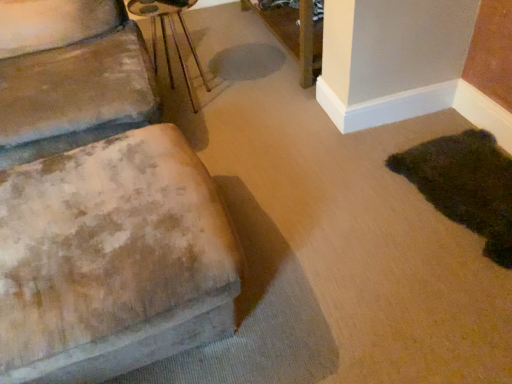
Question: In the image, is metallic silver side table at upper center positioned in front of or behind dark green plush rug at lower right?

Choices:
 (A) front
 (B) behind

Answer: (B)

Question: From the image's perspective, is metallic silver side table at upper center above or below dark green plush rug at lower right?

Choices:
 (A) below
 (B) above

Answer: (B)

Question: Which object is the farthest from the dark green plush rug at lower right?

Choices:
 (A) worn fabric ottoman at left
 (B) wooden table at upper center
 (C) metallic silver side table at upper center

Answer: (C)

Question: Which of these objects is positioned closest to the metallic silver side table at upper center?

Choices:
 (A) worn fabric ottoman at left
 (B) dark green plush rug at lower right
 (C) wooden table at upper center

Answer: (C)